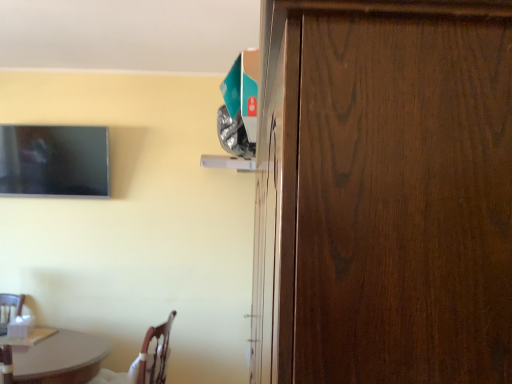
Question: Based on their positions, is dark wood door at right located to the left or right of wooden chair at lower left?

Choices:
 (A) right
 (B) left

Answer: (A)

Question: Which is correct: dark wood door at right is inside wooden chair at lower left, or outside of it?

Choices:
 (A) outside
 (B) inside

Answer: (A)

Question: Which of these objects is positioned farthest from the matte black tv at upper left?

Choices:
 (A) dark wood door at right
 (B) wooden chair at lower left

Answer: (A)

Question: Estimate the real-world distances between objects in this image. Which object is closer to the dark wood door at right?

Choices:
 (A) wooden chair at lower left
 (B) matte black tv at upper left

Answer: (A)